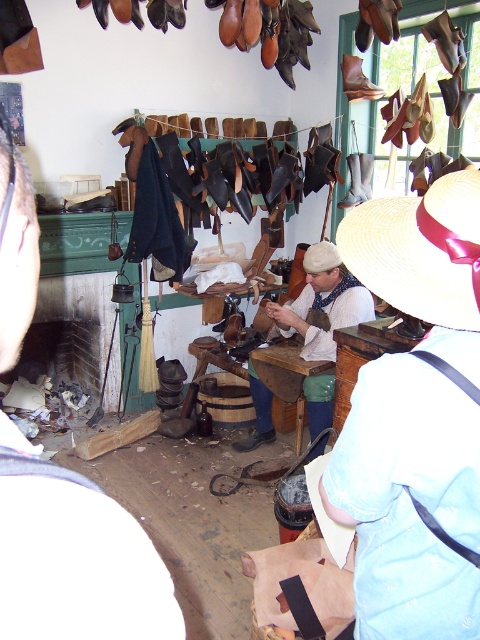
Can you confirm if leather boot at upper right is shorter than brown felt hat at center?

In fact, leather boot at upper right may be taller than brown felt hat at center.

In the scene shown: Is leather boot at upper right smaller than brown felt hat at center?

Yes, leather boot at upper right is smaller than brown felt hat at center.

Which is in front, point (444, 17) or point (317, 252)?

Point (444, 17)

Image resolution: width=480 pixels, height=640 pixels. Identify the location of leather boot at upper right. (445, 42).

Which is in front, point (455, 65) or point (261, 440)?

Point (455, 65) is more forward.

Is leather boot at upper right above matte leather shoe at center?

Correct, leather boot at upper right is located above matte leather shoe at center.

Who is more distant from viewer, (448, 42) or (251, 438)?

Positioned behind is point (251, 438).

Identify the location of leather boot at upper right. (445, 42).

Is white straw hat at upper center closer to camera compared to brown felt hat at center?

That is True.

Is white straw hat at upper center to the right of brown felt hat at center from the viewer's perspective?

Incorrect, white straw hat at upper center is not on the right side of brown felt hat at center.

Between point (459, 211) and point (305, 268), which one is positioned in front?

Positioned in front is point (459, 211).

Locate an element on the screen. white straw hat at upper center is located at coordinates (420, 250).